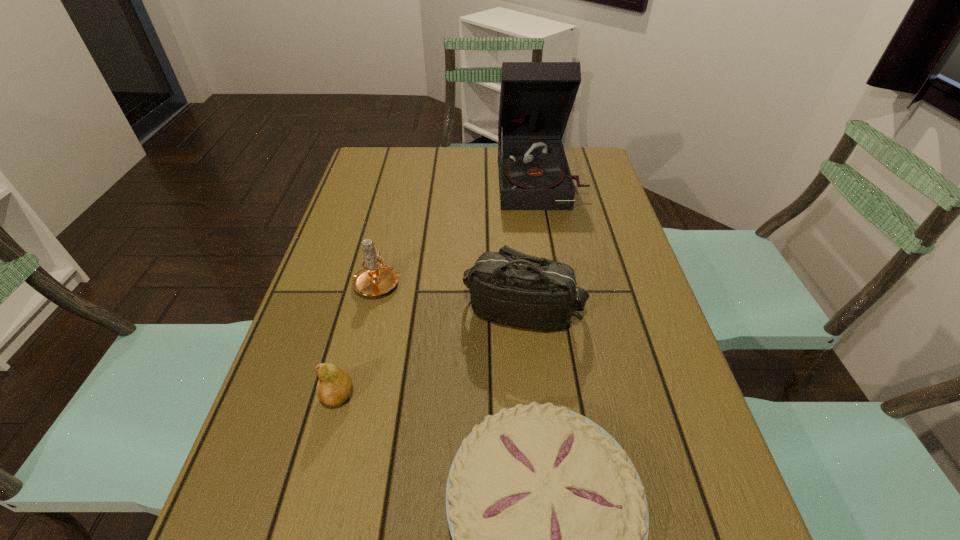
Where is `candle situated at the left edge`? The width and height of the screenshot is (960, 540). candle situated at the left edge is located at coordinates (374, 278).

Identify the location of pear present at the left edge. (334, 386).

Find the location of a particular element. This screenshot has height=540, width=960. object positioned at the right edge is located at coordinates (536, 98).

At what (x,y) coordinates should I click in order to perform the action: click on object situated at the far right corner. Please return your answer as a coordinate pair (x, y). Looking at the image, I should click on (536, 98).

Locate an element on the screen. The width and height of the screenshot is (960, 540). free space at the far edge is located at coordinates (463, 146).

In the image, there is a desktop. Where is `vacant area at the left edge`? vacant area at the left edge is located at coordinates (357, 195).

Find the location of a particular element. Image resolution: width=960 pixels, height=540 pixels. vacant space at the right edge is located at coordinates (712, 524).

This screenshot has height=540, width=960. Find the location of `vacant area at the far left corner`. vacant area at the far left corner is located at coordinates (385, 165).

Find the location of a particular element. The height and width of the screenshot is (540, 960). free area in between the shoulder bag and the fourth farthest object is located at coordinates (431, 354).

Locate an element on the screen. This screenshot has height=540, width=960. free spot between the shoulder bag and the pear is located at coordinates (431, 354).